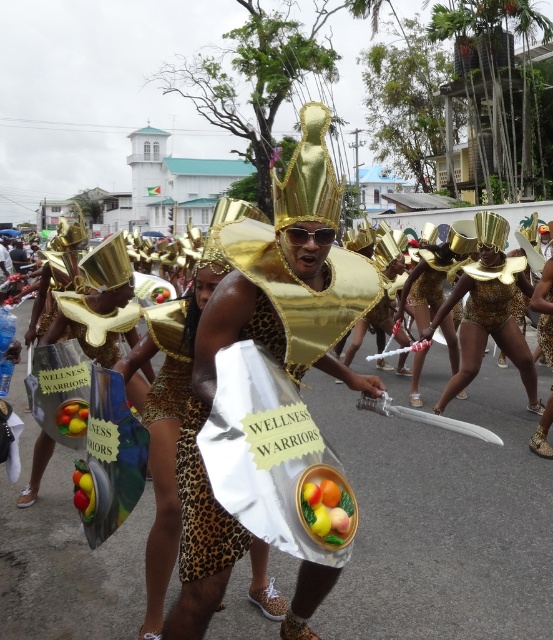
Question: Among these points, which one is farthest from the camera?

Choices:
 (A) (367, 262)
 (B) (86, 481)
 (C) (523, 257)
 (D) (322, 513)

Answer: (C)

Question: Can you confirm if smooth plastic fruit basket at center is wider than gold leopard print dress at center?

Choices:
 (A) no
 (B) yes

Answer: (A)

Question: Among these objects, which one is nearest to the camera?

Choices:
 (A) shiny plastic fruit at center
 (B) smooth plastic fruit basket at center

Answer: (B)

Question: Can you confirm if shiny plastic apple at center is positioned below shiny plastic fruit at center?

Choices:
 (A) yes
 (B) no

Answer: (A)

Question: Which of the following is the farthest from the observer?

Choices:
 (A) (301, 580)
 (B) (59, 412)

Answer: (B)

Question: Can you confirm if gold leopard print costume at center is smaller than gold leopard print dress at center?

Choices:
 (A) yes
 (B) no

Answer: (B)